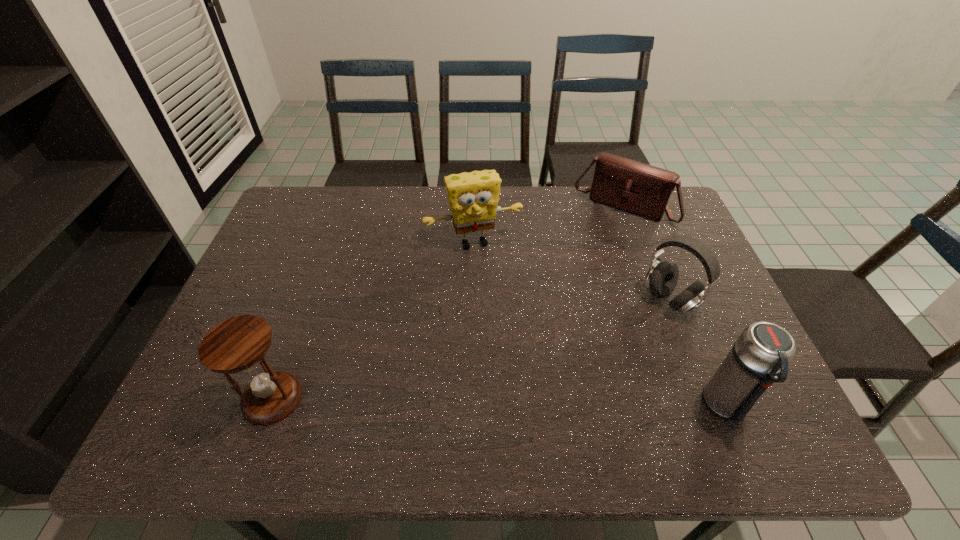
Find the location of a particular element. free space on the desktop that is between the leftmost object and the thermos bottle and is positioned on the ear cups of the headset is located at coordinates (509, 402).

Locate an element on the screen. Image resolution: width=960 pixels, height=540 pixels. vacant space on the desktop that is between the leftmost object and the thermos bottle and is positioned on the front flap of the shoulder bag is located at coordinates (510, 402).

At what (x,y) coordinates should I click in order to perform the action: click on free spot on the desktop that is between the hourglass and the thermos bottle and is positioned on the face of the fourth object from right to left. Please return your answer as a coordinate pair (x, y). Looking at the image, I should click on [x=532, y=403].